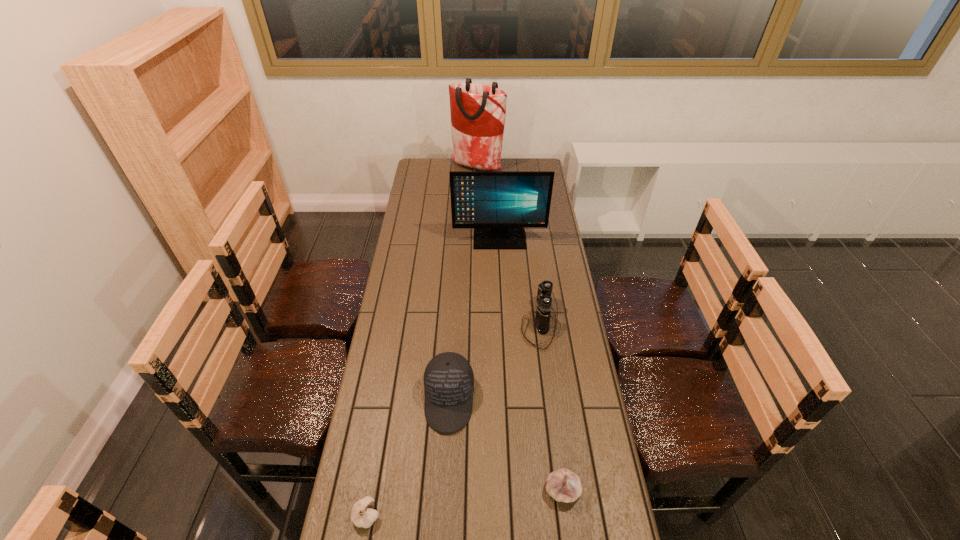
Where is `free region at the left edge of the desktop`? This screenshot has width=960, height=540. free region at the left edge of the desktop is located at coordinates (424, 278).

You are a GUI agent. You are given a task and a screenshot of the screen. Output one action in this format:
    pyautogui.click(x=<x>, y=<y>)
    Task: Click on the free space at the right edge of the desktop
    This screenshot has height=540, width=960.
    Given the screenshot: What is the action you would take?
    pyautogui.click(x=583, y=481)

The image size is (960, 540). Identify the location of free point between the farthest object and the taller garlic. (520, 329).

The width and height of the screenshot is (960, 540). In order to click on unoccupied area between the fourth nearest object and the fourth farthest object in this screenshot , I will do `click(494, 361)`.

Point out which object is positioned as the second nearest to the tallest object. Please provide its 2D coordinates. Your answer should be formatted as a tuple, i.e. [(x, y)], where the tuple contains the x and y coordinates of a point satisfying the conditions above.

[(542, 319)]

This screenshot has height=540, width=960. I want to click on object that can be found as the fourth closest to the fifth nearest object, so click(563, 485).

The width and height of the screenshot is (960, 540). I want to click on free point that satisfies the following two spatial constraints: 1. on the screen side of the taller garlic; 2. on the right side of the fifth shortest object, so click(x=512, y=490).